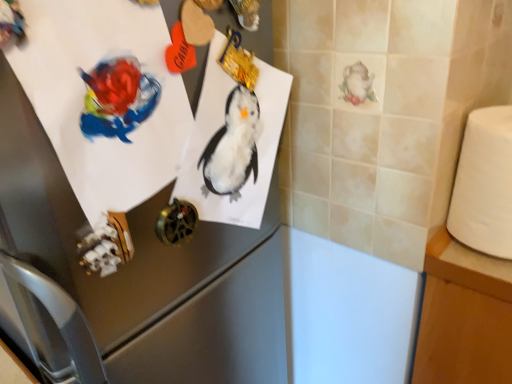
Question: Considering the positions of point (419, 359) and point (122, 110), is point (419, 359) closer or farther from the camera than point (122, 110)?

Choices:
 (A) closer
 (B) farther

Answer: (B)

Question: Visually, is white wood table at right positioned to the left or to the right of matte paper penguin at upper left?

Choices:
 (A) left
 (B) right

Answer: (B)

Question: Considering the real-world distances, which object is closest to the white matte toilet paper at right?

Choices:
 (A) white wood table at right
 (B) matte paper penguin at upper left
 (C) satin silver refrigerator at upper left

Answer: (A)

Question: Estimate the real-world distances between objects in this image. Which object is farther from the satin silver refrigerator at upper left?

Choices:
 (A) white wood table at right
 (B) matte paper penguin at upper left
 (C) white matte toilet paper at right

Answer: (C)